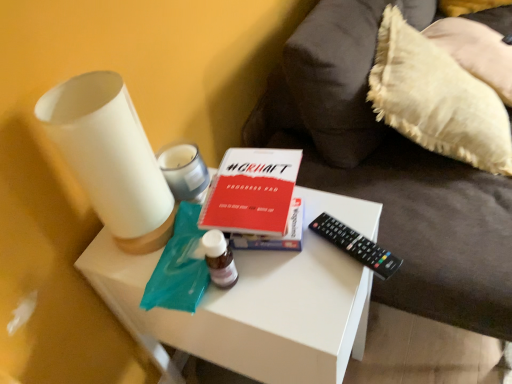
Describe the element at coordinates (256, 303) in the screenshot. I see `white matte table at center` at that location.

Describe the element at coordinates (184, 171) in the screenshot. The width and height of the screenshot is (512, 384). I see `white glossy candle at upper center, marked as the first candle holder in a back-to-front arrangement` at that location.

At what (x,y) coordinates should I click in order to perform the action: click on black plastic remote at right. Please return your answer as a coordinate pair (x, y). Looking at the image, I should click on (356, 245).

What is the approximate height of black plastic remote at right?

1.39 inches.

At what (x,y) coordinates should I click in order to perform the action: click on white matte vase at left, positioned as the first candle holder in front-to-back order. Please return your answer as a coordinate pair (x, y). This screenshot has width=512, height=384. Looking at the image, I should click on (110, 158).

Where is `white matte side table at center`? The height and width of the screenshot is (384, 512). white matte side table at center is located at coordinates (390, 171).

Consider the image. From the image's perspective, does white glossy candle at upper center, the 2th candle holder in the front-to-back sequence, appear lower than white matte vase at left, positioned as the first candle holder in front-to-back order?

Indeed, from the image's perspective, white glossy candle at upper center, the 2th candle holder in the front-to-back sequence, is shown beneath white matte vase at left, positioned as the first candle holder in front-to-back order.

From the picture: From a real-world perspective, is white glossy candle at upper center, the 2th candle holder in the front-to-back sequence, on top of white matte vase at left, positioned as the first candle holder in front-to-back order?

No, from a real-world perspective, white glossy candle at upper center, the 2th candle holder in the front-to-back sequence, is not above white matte vase at left, positioned as the first candle holder in front-to-back order.

Which object is wider, white glossy candle at upper center, the 2th candle holder in the front-to-back sequence, or white matte vase at left, positioned as the first candle holder in front-to-back order?

white matte vase at left, positioned as the first candle holder in front-to-back order, is wider.

What's the angular difference between black plastic remote at right and red matte progress pad at center's facing directions?

28.6 degrees separate the facing orientations of black plastic remote at right and red matte progress pad at center.

Is point (373, 266) closer or farther from the camera than point (228, 215)?

Point (373, 266) is farther from the camera than point (228, 215).

Is black plastic remote at right not inside red matte progress pad at center?

Yes, black plastic remote at right is outside of red matte progress pad at center.

Is black plastic remote at right wider or thinner than red matte progress pad at center?

In the image, black plastic remote at right appears to be more narrow than red matte progress pad at center.

Is white glossy candle at upper center, the 2th candle holder in the front-to-back sequence, facing towards white fluffy pillow at right?

No, white glossy candle at upper center, the 2th candle holder in the front-to-back sequence, is not turned towards white fluffy pillow at right.

Where is `pillow above the white glossy candle at upper center, marked as the first candle holder in a back-to-front arrangement (from the image's perspective)`? pillow above the white glossy candle at upper center, marked as the first candle holder in a back-to-front arrangement (from the image's perspective) is located at coordinates (437, 99).

Considering the sizes of objects white glossy candle at upper center, the 2th candle holder in the front-to-back sequence, and white fluffy pillow at right in the image provided, who is thinner, white glossy candle at upper center, the 2th candle holder in the front-to-back sequence, or white fluffy pillow at right?

white glossy candle at upper center, the 2th candle holder in the front-to-back sequence.

Is there a large distance between white glossy candle at upper center, the 2th candle holder in the front-to-back sequence, and white fluffy pillow at right?

white glossy candle at upper center, the 2th candle holder in the front-to-back sequence, is near white fluffy pillow at right, not far away.

Can you confirm if white glossy candle at upper center, the 2th candle holder in the front-to-back sequence, is taller than red matte progress pad at center?

Indeed, white glossy candle at upper center, the 2th candle holder in the front-to-back sequence, has a greater height compared to red matte progress pad at center.

Considering the positions of objects white glossy candle at upper center, the 2th candle holder in the front-to-back sequence, and red matte progress pad at center in the image provided, who is behind, white glossy candle at upper center, the 2th candle holder in the front-to-back sequence, or red matte progress pad at center?

Positioned behind is white glossy candle at upper center, the 2th candle holder in the front-to-back sequence.

Would you say white glossy candle at upper center, the 2th candle holder in the front-to-back sequence, is inside or outside red matte progress pad at center?

white glossy candle at upper center, the 2th candle holder in the front-to-back sequence, is outside red matte progress pad at center.

Which object is positioned more to the right, white glossy candle at upper center, the 2th candle holder in the front-to-back sequence, or red matte progress pad at center?

red matte progress pad at center is more to the right.

Looking at their sizes, would you say red matte progress pad at center is wider or thinner than black plastic remote at right?

In the image, red matte progress pad at center appears to be wider than black plastic remote at right.

Is red matte progress pad at center positioned with its back to black plastic remote at right?

No, red matte progress pad at center's orientation is not away from black plastic remote at right.

From a real-world perspective, which object stands above the other?

From a 3D spatial view, red matte progress pad at center is above.

What's the angular difference between red matte progress pad at center and black plastic remote at right's facing directions?

red matte progress pad at center and black plastic remote at right are facing 28.6 degrees away from each other.

Between white matte side table at center and red matte progress pad at center, which one is positioned in front?

white matte side table at center.

Which is more to the left, white matte side table at center or red matte progress pad at center?

From the viewer's perspective, red matte progress pad at center appears more on the left side.

Is point (311, 164) positioned behind point (274, 223)?

That is True.

In the scene shown: Does white matte side table at center have a larger size compared to red matte progress pad at center?

Indeed, white matte side table at center has a larger size compared to red matte progress pad at center.

Which is farther, [305,47] or [106,203]?

The point [305,47] is more distant.

Is white matte vase at left, positioned as the first candle holder in front-to-back order, a part of white matte side table at center?

No, white matte vase at left, positioned as the first candle holder in front-to-back order, is not surrounded by white matte side table at center.

From a real-world perspective, which object rests below the other?

In real-world perspective, white matte side table at center is lower.

Locate an element on the screen. candle holder to the right of white matte vase at left, the second candle holder positioned from the back is located at coordinates (184, 171).

This screenshot has width=512, height=384. I want to click on remote control that is below the red matte progress pad at center (from the image's perspective), so (x=356, y=245).

When comparing their distances from white matte table at center, does black plastic remote at right or red matte progress pad at center seem further?

Among the two, black plastic remote at right is located further to white matte table at center.

Considering their positions, is white fluffy pillow at right positioned closer to white matte vase at left, the second candle holder positioned from the back, than white matte table at center?

white matte table at center.

Which object lies nearer to the anchor point white matte table at center, black plastic remote at right or white matte side table at center?

black plastic remote at right is positioned closer to the anchor white matte table at center.

Based on their spatial positions, is white matte table at center or white fluffy pillow at right further from black plastic remote at right?

Among the two, white fluffy pillow at right is located further to black plastic remote at right.

Estimate the real-world distances between objects in this image. Which object is further from white fluffy pillow at right, white glossy candle at upper center, marked as the first candle holder in a back-to-front arrangement, or white matte vase at left, the second candle holder positioned from the back?

white matte vase at left, the second candle holder positioned from the back, lies further to white fluffy pillow at right than the other object.

Which object lies nearer to the anchor point white glossy candle at upper center, the 2th candle holder in the front-to-back sequence, white matte side table at center or white matte table at center?

white matte table at center lies closer to white glossy candle at upper center, the 2th candle holder in the front-to-back sequence, than the other object.

Considering their positions, is red matte progress pad at center positioned further to black plastic remote at right than white matte side table at center?

Among the two, white matte side table at center is located further to black plastic remote at right.

Which object lies further to the anchor point white matte side table at center, white glossy candle at upper center, marked as the first candle holder in a back-to-front arrangement, or red matte progress pad at center?

white glossy candle at upper center, marked as the first candle holder in a back-to-front arrangement, is further to white matte side table at center.

Locate an element on the screen. paperback book between white glossy candle at upper center, marked as the first candle holder in a back-to-front arrangement, and black plastic remote at right, in the horizontal direction is located at coordinates (252, 192).

Identify the location of pillow between white matte side table at center and black plastic remote at right in the up-down direction. The image size is (512, 384). (437, 99).

Image resolution: width=512 pixels, height=384 pixels. I want to click on remote control between white matte vase at left, the second candle holder positioned from the back, and white fluffy pillow at right, so click(x=356, y=245).

At what (x,y) coordinates should I click in order to perform the action: click on paperback book between white matte side table at center and white matte table at center in the vertical direction. Please return your answer as a coordinate pair (x, y). The image size is (512, 384). Looking at the image, I should click on (252, 192).